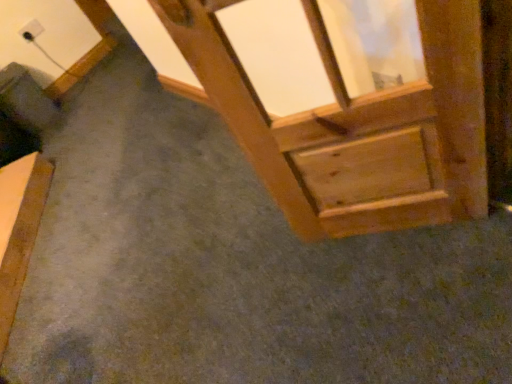
Question: Does white plastic outlet at upper left have a greater width compared to wooden bed frame at lower left?

Choices:
 (A) no
 (B) yes

Answer: (A)

Question: Can you confirm if white plastic outlet at upper left is taller than wooden bed frame at lower left?

Choices:
 (A) no
 (B) yes

Answer: (A)

Question: From a real-world perspective, is white plastic outlet at upper left below wooden bed frame at lower left?

Choices:
 (A) yes
 (B) no

Answer: (B)

Question: Considering the relative sizes of white plastic outlet at upper left and wooden bed frame at lower left in the image provided, is white plastic outlet at upper left thinner than wooden bed frame at lower left?

Choices:
 (A) yes
 (B) no

Answer: (A)

Question: Is white plastic outlet at upper left looking in the opposite direction of wooden bed frame at lower left?

Choices:
 (A) yes
 (B) no

Answer: (B)

Question: Is white plastic outlet at upper left situated inside wooden bed frame at lower left or outside?

Choices:
 (A) outside
 (B) inside

Answer: (A)

Question: Considering the positions of white plastic outlet at upper left and wooden bed frame at lower left in the image, is white plastic outlet at upper left taller or shorter than wooden bed frame at lower left?

Choices:
 (A) tall
 (B) short

Answer: (B)

Question: From the image's perspective, is white plastic outlet at upper left above or below wooden bed frame at lower left?

Choices:
 (A) below
 (B) above

Answer: (B)

Question: Visually, is white plastic outlet at upper left positioned to the left or to the right of wooden bed frame at lower left?

Choices:
 (A) right
 (B) left

Answer: (B)

Question: From the image's perspective, relative to wooden bed frame at lower left, is wooden frame at upper right above or below?

Choices:
 (A) below
 (B) above

Answer: (B)

Question: From a real-world perspective, is wooden frame at upper right positioned above or below wooden bed frame at lower left?

Choices:
 (A) below
 (B) above

Answer: (B)

Question: Does point (172, 18) appear closer or farther from the camera than point (36, 167)?

Choices:
 (A) closer
 (B) farther

Answer: (A)

Question: In terms of width, does wooden frame at upper right look wider or thinner when compared to wooden bed frame at lower left?

Choices:
 (A) thin
 (B) wide

Answer: (A)

Question: From the image's perspective, is white plastic outlet at upper left located above or below wooden frame at upper right?

Choices:
 (A) below
 (B) above

Answer: (B)

Question: From a real-world perspective, is white plastic outlet at upper left positioned above or below wooden frame at upper right?

Choices:
 (A) below
 (B) above

Answer: (A)